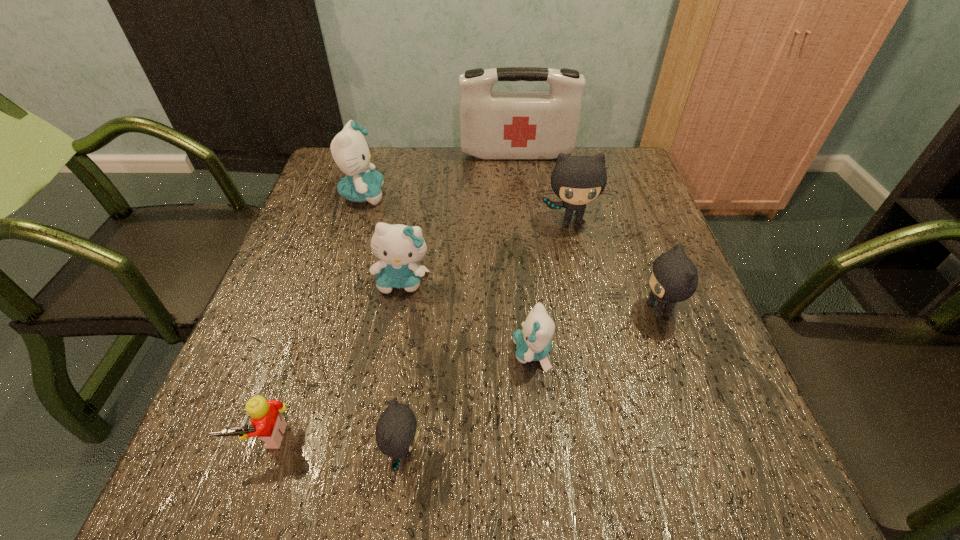
This screenshot has height=540, width=960. Identify the location of kitten present at the near edge. (396, 432).

I want to click on kitten at the left edge, so click(350, 151).

At what (x,y) coordinates should I click in order to perform the action: click on Lego situated at the left edge. Please return your answer as a coordinate pair (x, y). The height and width of the screenshot is (540, 960). Looking at the image, I should click on (268, 424).

I want to click on object positioned at the far left corner, so click(350, 151).

This screenshot has width=960, height=540. What are the coordinates of `object that is at the near left corner` in the screenshot? It's located at (268, 424).

Where is `free space at the far edge of the desktop`? This screenshot has height=540, width=960. free space at the far edge of the desktop is located at coordinates (481, 162).

The image size is (960, 540). In the image, there is a desktop. In order to click on vacant space at the near edge in this screenshot , I will do `click(658, 464)`.

The height and width of the screenshot is (540, 960). I want to click on vacant space at the left edge of the desktop, so click(309, 391).

Image resolution: width=960 pixels, height=540 pixels. I want to click on free region at the right edge, so click(x=659, y=346).

The image size is (960, 540). In the image, there is a desktop. Find the location of `vacant region at the far left corner`. vacant region at the far left corner is located at coordinates (331, 166).